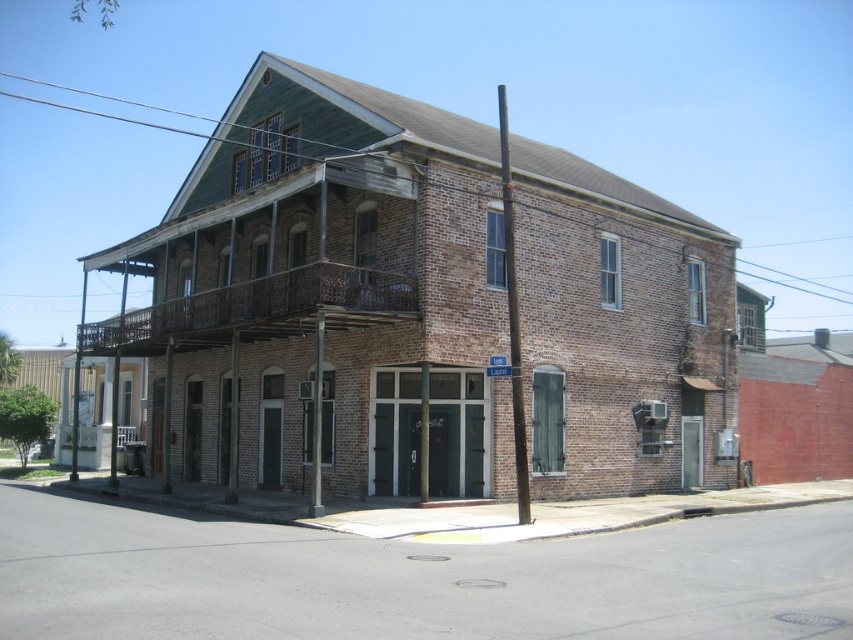
Question: Is metallic pole at center thinner than metallic pole at lower center?

Choices:
 (A) yes
 (B) no

Answer: (B)

Question: Which of the following is the farthest from the observer?

Choices:
 (A) brown wooden pole at lower left
 (B) brown wrought iron balcony at upper center

Answer: (A)

Question: Is rusty metal balcony at center to the right of brown wooden pole at lower left from the viewer's perspective?

Choices:
 (A) no
 (B) yes

Answer: (B)

Question: Which point is closer to the camera?

Choices:
 (A) (86, 344)
 (B) (235, 468)
 (C) (111, 436)

Answer: (B)

Question: Which point is farther from the camera taking this photo?

Choices:
 (A) (213, 316)
 (B) (228, 257)
 (C) (427, 387)
 (D) (234, 342)

Answer: (B)

Question: Does brown wooden pole at center have a lesser width compared to brown wooden pole at lower left?

Choices:
 (A) no
 (B) yes

Answer: (A)